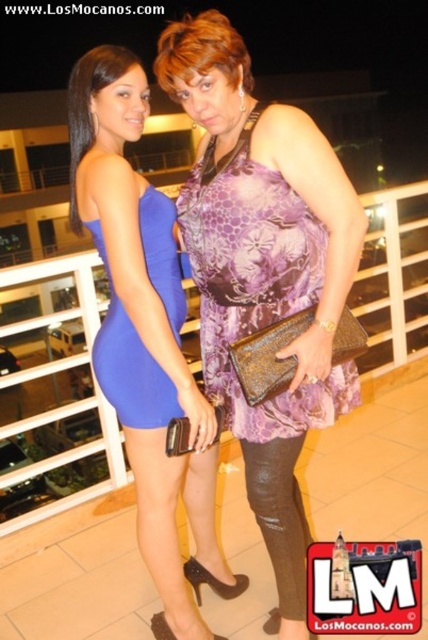
Who is taller, purple floral fabric dress at center or matte purple dress at center?

With more height is matte purple dress at center.

What do you see at coordinates (256, 282) in the screenshot? The height and width of the screenshot is (640, 428). I see `purple floral fabric dress at center` at bounding box center [256, 282].

Locate an element on the screen. purple floral fabric dress at center is located at coordinates (256, 282).

Is blue satin dress at center to the right of matte blue dress at center from the viewer's perspective?

Indeed, blue satin dress at center is positioned on the right side of matte blue dress at center.

From the picture: Between blue satin dress at center and matte blue dress at center, which one is positioned higher?

matte blue dress at center is higher up.

Find the location of a particular element. This screenshot has height=640, width=428. blue satin dress at center is located at coordinates (145, 336).

Who is more forward, (261, 188) or (74, 115)?

Point (261, 188) is in front.

Describe the element at coordinates (264, 272) in the screenshot. The height and width of the screenshot is (640, 428). I see `purple printed dress at center` at that location.

Is point (279, 252) behind point (115, 244)?

That is True.

Where is `purple printed dress at center`? This screenshot has width=428, height=640. purple printed dress at center is located at coordinates (264, 272).